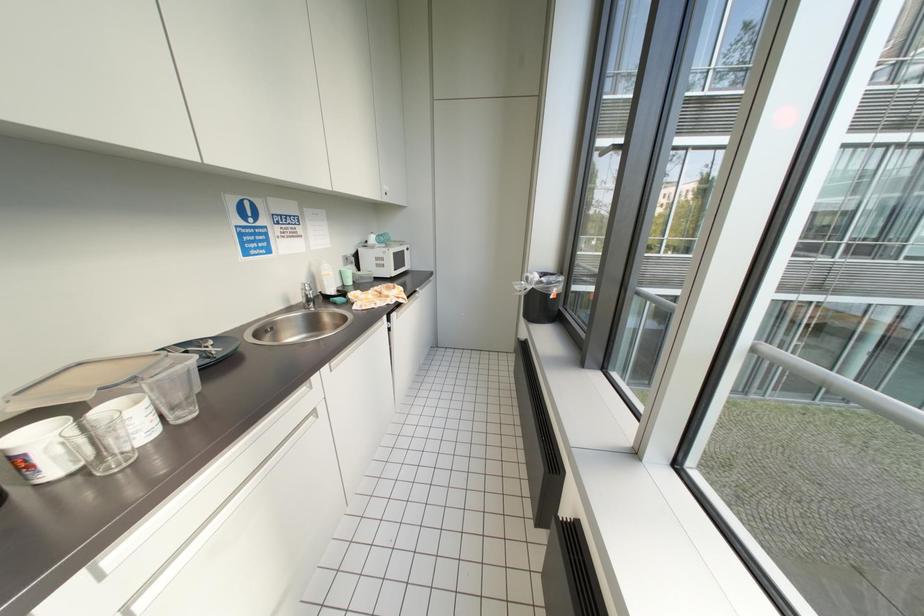
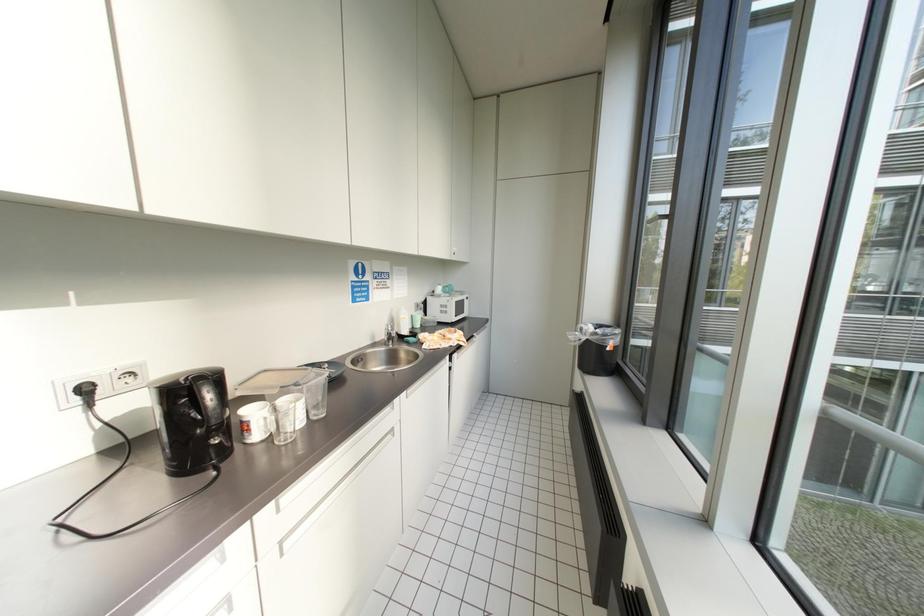
Question: Based on the continuous images, in which direction is the camera rotating? Reply with the corresponding letter.

Choices:
 (A) Left
 (B) Right
 (C) Up
 (D) Down

Answer: (A)